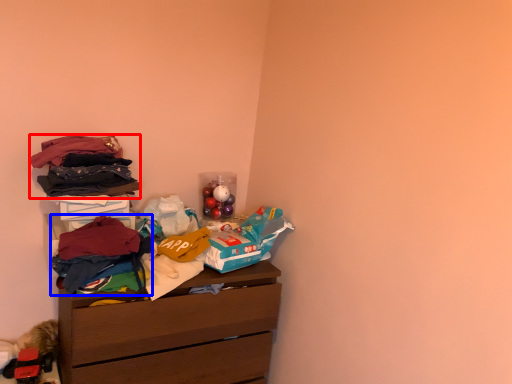
Question: Which object appears closest to the camera in this image, clothing (highlighted by a red box) or clothing (highlighted by a blue box)?

Choices:
 (A) clothing
 (B) clothing

Answer: (B)